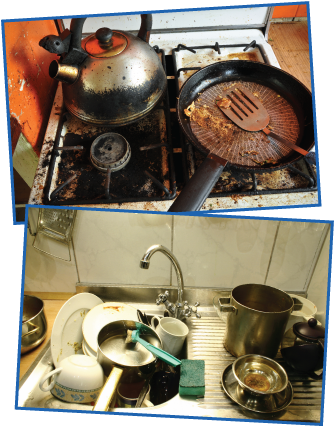
Where is `tall silver pot next to sink`? The height and width of the screenshot is (427, 335). tall silver pot next to sink is located at coordinates (250, 328).